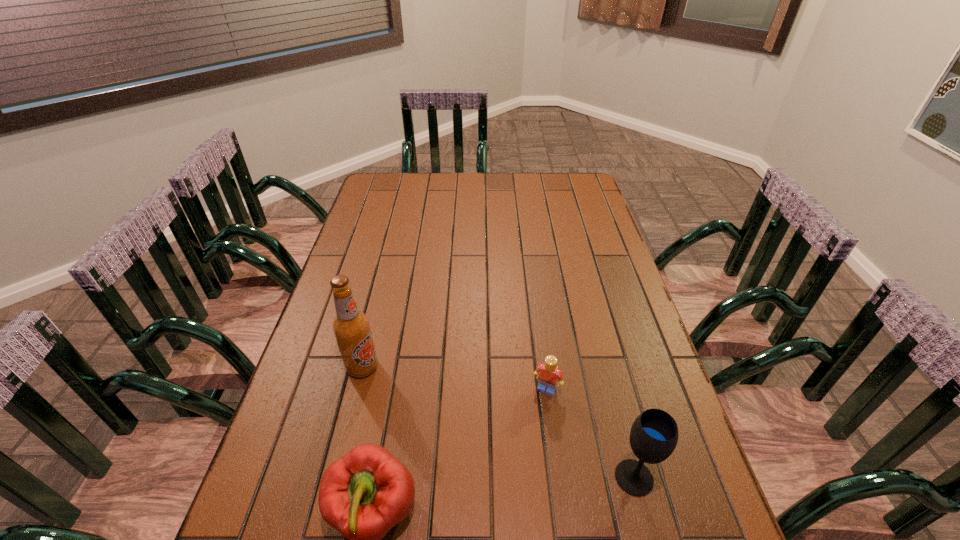
Identify the location of object that is the closest to the Lego. (654, 434).

Image resolution: width=960 pixels, height=540 pixels. I want to click on vacant space that satisfies the following two spatial constraints: 1. on the front side of the second tallest object; 2. on the left side of the Lego, so click(x=559, y=477).

Locate an element on the screen. The image size is (960, 540). free location that satisfies the following two spatial constraints: 1. on the front side of the third object from left to right; 2. on the right side of the second tallest object is located at coordinates (559, 477).